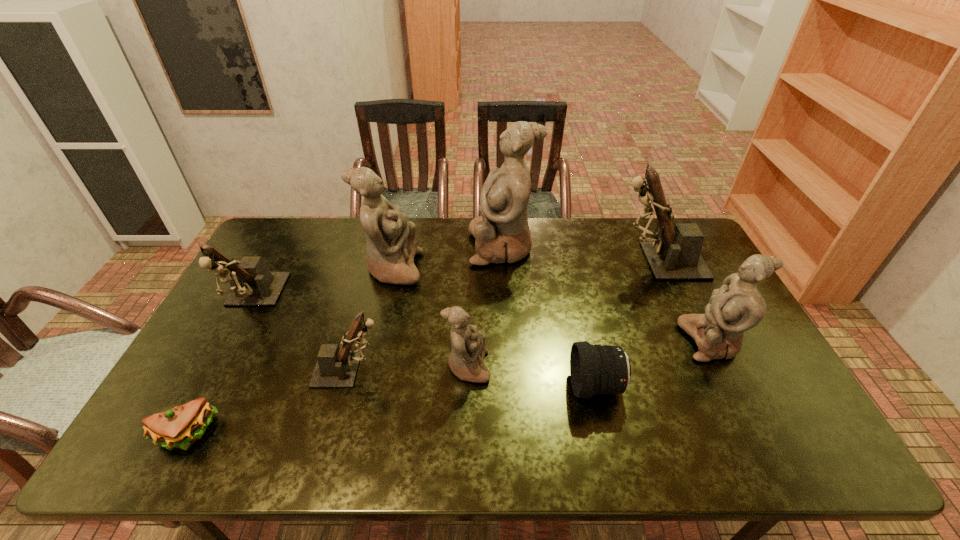
Image resolution: width=960 pixels, height=540 pixels. What are the coordinates of `the tallest figurine` in the screenshot? It's located at (502, 234).

At what (x,y) coordinates should I click in order to perform the action: click on the tallest object. Please return your answer as a coordinate pair (x, y). Looking at the image, I should click on (502, 234).

Identify the location of the leftmost white figurine. (391, 245).

What are the coordinates of `the rightmost brown figurine` in the screenshot? It's located at (674, 254).

Find the location of a particular element. This screenshot has height=540, width=960. the leftmost brown figurine is located at coordinates (252, 284).

Identify the location of the second biggest brown figurine. This screenshot has width=960, height=540. coord(252,284).

What are the coordinates of `the rightmost white figurine` in the screenshot? It's located at (738, 306).

The image size is (960, 540). In order to click on the smallest white figurine in this screenshot , I will do `click(466, 360)`.

At what (x,y) coordinates should I click in order to perform the action: click on the second brown figurine from left to right. Please return your answer as a coordinate pair (x, y). Looking at the image, I should click on (336, 367).

Where is `the nearest brown figurine`? The image size is (960, 540). the nearest brown figurine is located at coordinates (336, 367).